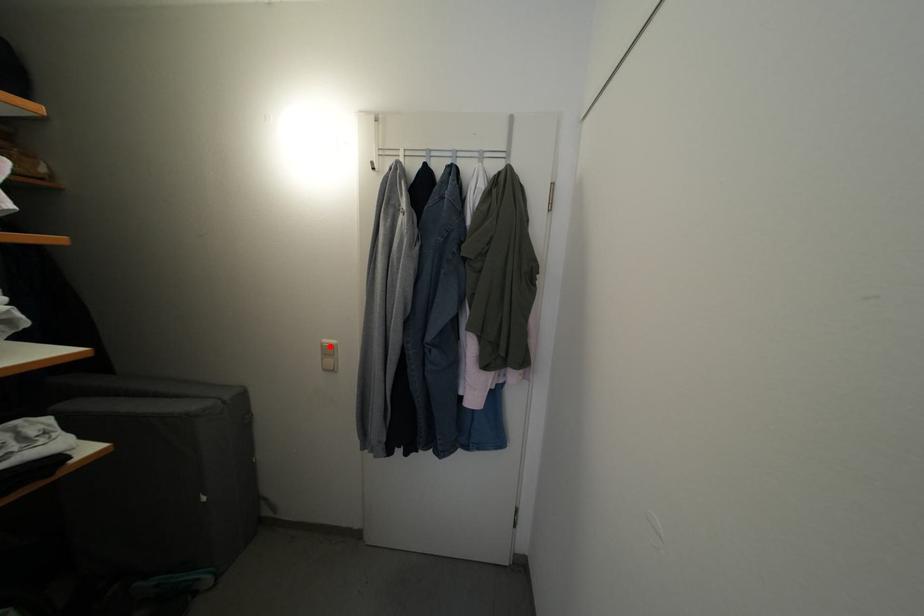
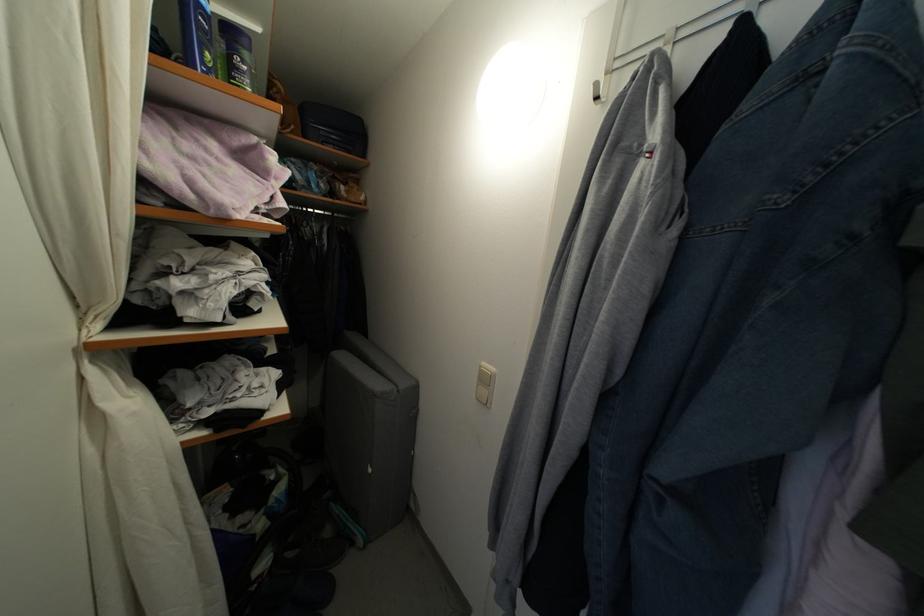
Find the pixel in the second image that matches the highlighted location in the first image.

(489, 370)